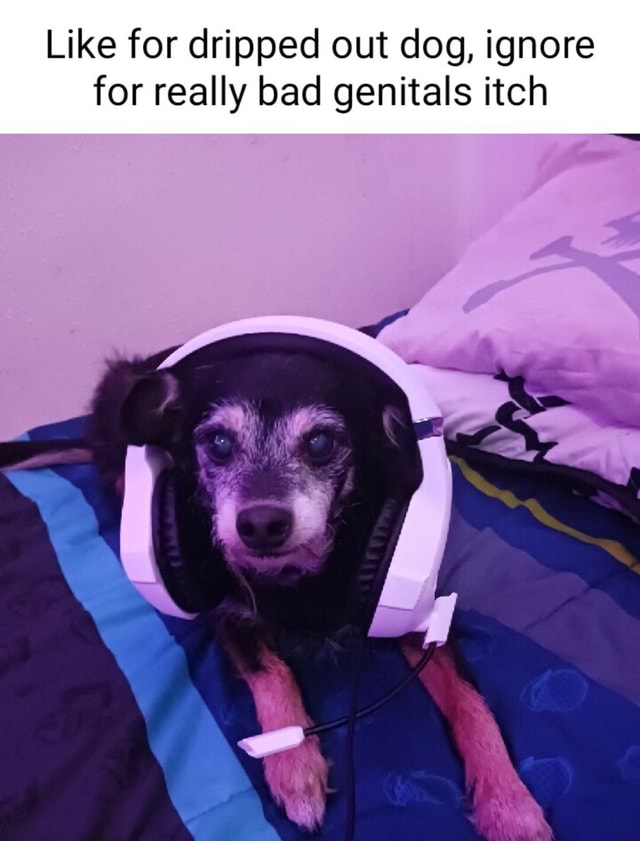
The image size is (640, 841). What are the coordinates of `pillow` in the screenshot? It's located at (561, 288).